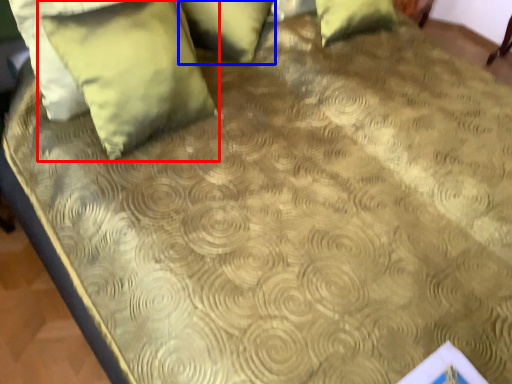
Question: Which point is closer to the camera, pillow (highlighted by a red box) or pillow (highlighted by a blue box)?

Choices:
 (A) pillow
 (B) pillow

Answer: (A)